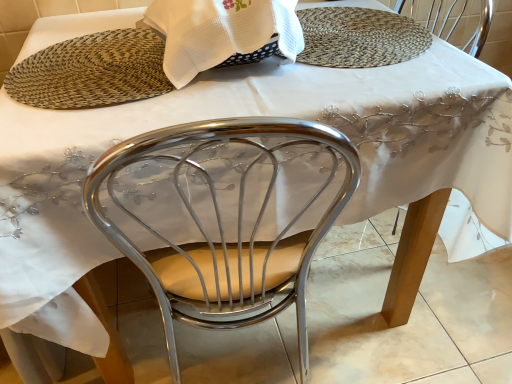
Where is `woven straw placemat at upper center`? woven straw placemat at upper center is located at coordinates (359, 37).

The image size is (512, 384). What do you see at coordinates (220, 32) in the screenshot?
I see `white woven cloth at upper center` at bounding box center [220, 32].

You are a GUI agent. You are given a task and a screenshot of the screen. Output one action in this format:
    pyautogui.click(x=<x>, y=<y>)
    Task: Click on the woven straw placemat at upper center
    The image size is (512, 384).
    Given the screenshot: What is the action you would take?
    pyautogui.click(x=359, y=37)

Is woven straw placemat at upper center placed right next to white woven cloth at upper center?

No, woven straw placemat at upper center is not with white woven cloth at upper center.

Does woven straw placemat at upper center appear on the left side of white woven cloth at upper center?

No.

In the image, is woven straw placemat at upper center positioned in front of or behind white woven cloth at upper center?

Visually, woven straw placemat at upper center is located behind white woven cloth at upper center.

Does woven straw placemat at upper center turn towards white woven cloth at upper center?

No, woven straw placemat at upper center is not turned towards white woven cloth at upper center.

Is white woven cloth at upper center oriented towards woven straw placemat at upper center?

No, white woven cloth at upper center is not oriented towards woven straw placemat at upper center.

Considering the positions of objects white woven cloth at upper center and woven straw placemat at upper center in the image provided, who is more to the right, white woven cloth at upper center or woven straw placemat at upper center?

Positioned to the right is woven straw placemat at upper center.

From the picture: Is white woven cloth at upper center in contact with woven straw placemat at upper center?

white woven cloth at upper center is not next to woven straw placemat at upper center, and they're not touching.

At what (x,y) coordinates should I click in order to perform the action: click on plate behind the woven mat at upper center. Please return your answer as a coordinate pair (x, y). Image resolution: width=512 pixels, height=384 pixels. Looking at the image, I should click on (359, 37).

Are woven straw placemat at upper center and woven mat at upper center located far from each other?

No, woven straw placemat at upper center is not far from woven mat at upper center.

Which is closer to the camera, (396, 34) or (79, 72)?

Point (79, 72)

Considering the sizes of objects white woven cloth at upper center and woven mat at upper center in the image provided, who is thinner, white woven cloth at upper center or woven mat at upper center?

white woven cloth at upper center is thinner.

I want to click on blanket on the right of woven mat at upper center, so click(x=220, y=32).

In terms of size, does white woven cloth at upper center appear bigger or smaller than woven mat at upper center?

Considering their sizes, white woven cloth at upper center takes up more space than woven mat at upper center.

Considering the positions of objects woven mat at upper center and white woven cloth at upper center in the image provided, who is in front, woven mat at upper center or white woven cloth at upper center?

white woven cloth at upper center is closer to the camera.

In terms of size, does woven mat at upper center appear bigger or smaller than white woven cloth at upper center?

woven mat at upper center is smaller than white woven cloth at upper center.

Does woven mat at upper center appear on the left side of white woven cloth at upper center?

Indeed, woven mat at upper center is positioned on the left side of white woven cloth at upper center.

Between woven mat at upper center and white woven cloth at upper center, which one has larger width?

woven mat at upper center.

From a real-world perspective, between woven mat at upper center and woven straw placemat at upper center, who is vertically lower?

woven straw placemat at upper center.

Is woven mat at upper center facing away from woven straw placemat at upper center?

No.

Between woven mat at upper center and woven straw placemat at upper center, which one has larger width?

With larger width is woven straw placemat at upper center.

Identify the location of plate that appears below the white woven cloth at upper center (from the image's perspective). (359, 37).

This screenshot has height=384, width=512. What are the coordinates of `plate lying behind the white woven cloth at upper center` in the screenshot? It's located at (359, 37).

Which object lies further to the anchor point white woven cloth at upper center, woven straw placemat at upper center or woven mat at upper center?

Based on the image, woven straw placemat at upper center appears to be further to white woven cloth at upper center.

Looking at the image, which one is located closer to woven straw placemat at upper center, white woven cloth at upper center or woven mat at upper center?

The object closer to woven straw placemat at upper center is white woven cloth at upper center.

Based on their spatial positions, is white woven cloth at upper center or woven straw placemat at upper center closer to woven mat at upper center?

The object closer to woven mat at upper center is white woven cloth at upper center.

Looking at this image, looking at the image, which one is located closer to white woven cloth at upper center, woven mat at upper center or woven straw placemat at upper center?

Among the two, woven mat at upper center is located nearer to white woven cloth at upper center.

From the image, which object appears to be nearer to woven straw placemat at upper center, woven mat at upper center or white woven cloth at upper center?

white woven cloth at upper center lies closer to woven straw placemat at upper center than the other object.

Which object lies further to the anchor point woven mat at upper center, woven straw placemat at upper center or white woven cloth at upper center?

woven straw placemat at upper center is further to woven mat at upper center.

Locate an element on the screen. The height and width of the screenshot is (384, 512). blanket between woven mat at upper center and woven straw placemat at upper center in the horizontal direction is located at coordinates (220, 32).